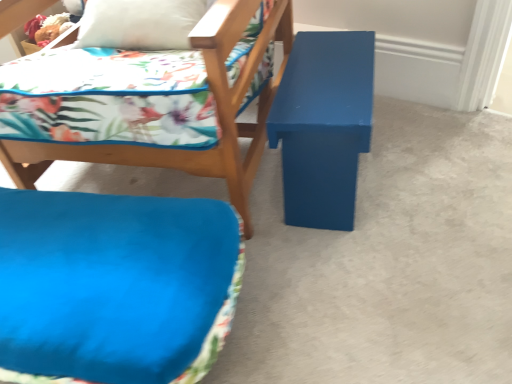
Where is `vacant area on top of blue matte bench at center (from a real-world perspective)`? The image size is (512, 384). vacant area on top of blue matte bench at center (from a real-world perspective) is located at coordinates (347, 223).